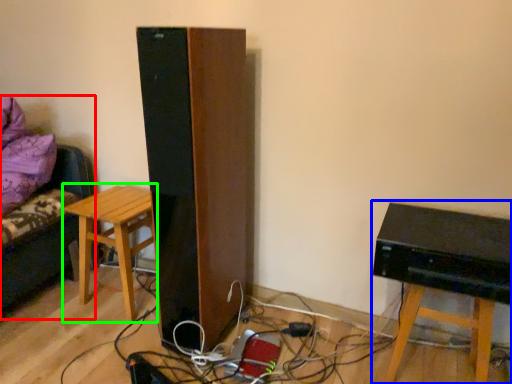
Question: Based on their relative distances, which object is nearer to furniture (highlighted by a red box)? Choose from computer (highlighted by a blue box) and stool (highlighted by a green box).

Choices:
 (A) computer
 (B) stool

Answer: (B)